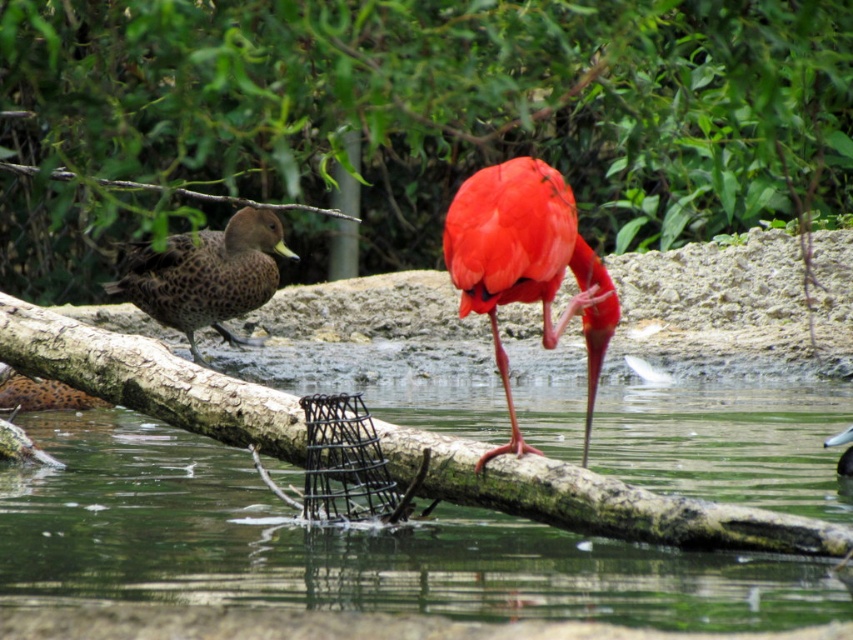
From the picture: You are a birdwatcher observing the scene. You notice two ducks in the image. Which duck, the spotted brown duck at left or the brown speckled duck at upper left, is taller?

The spotted brown duck at left is taller than the brown speckled duck at upper left.

You are an ornithologist observing the scene. You notice the green leafy tree at upper center and the brown speckled duck at upper left. Which object is located to the left of the other?

The green leafy tree at upper center is positioned on the left side of brown speckled duck at upper left, so the tree is to the left of the duck.